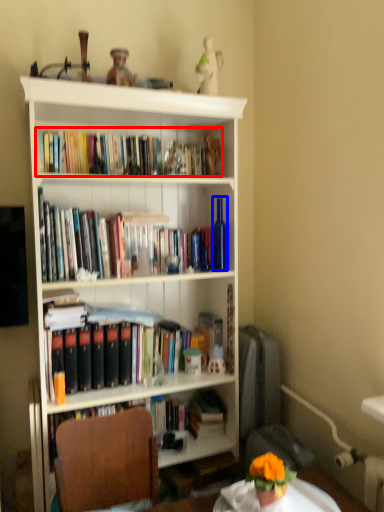
Question: Which object appears farthest to the camera in this image, book (highlighted by a red box) or bottle (highlighted by a blue box)?

Choices:
 (A) book
 (B) bottle

Answer: (B)